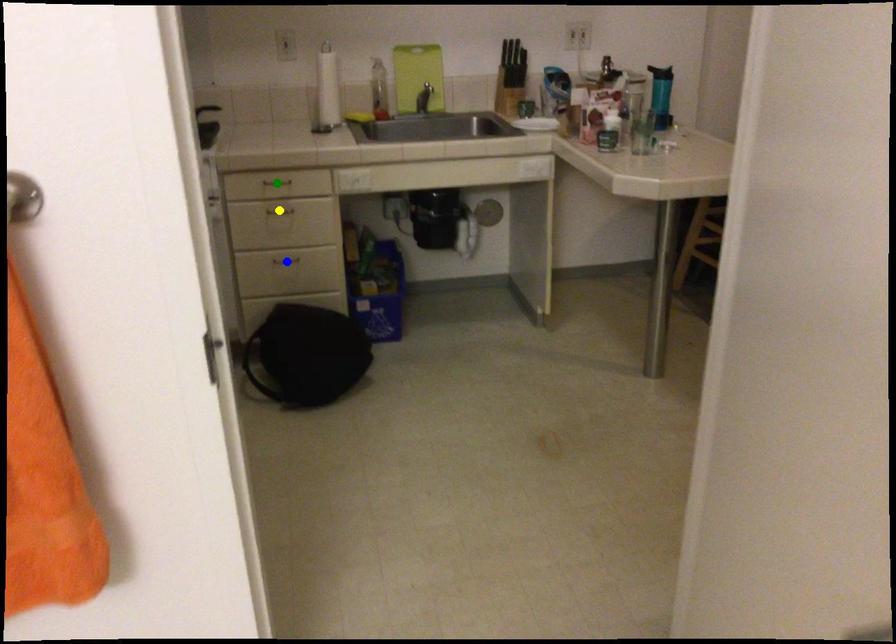
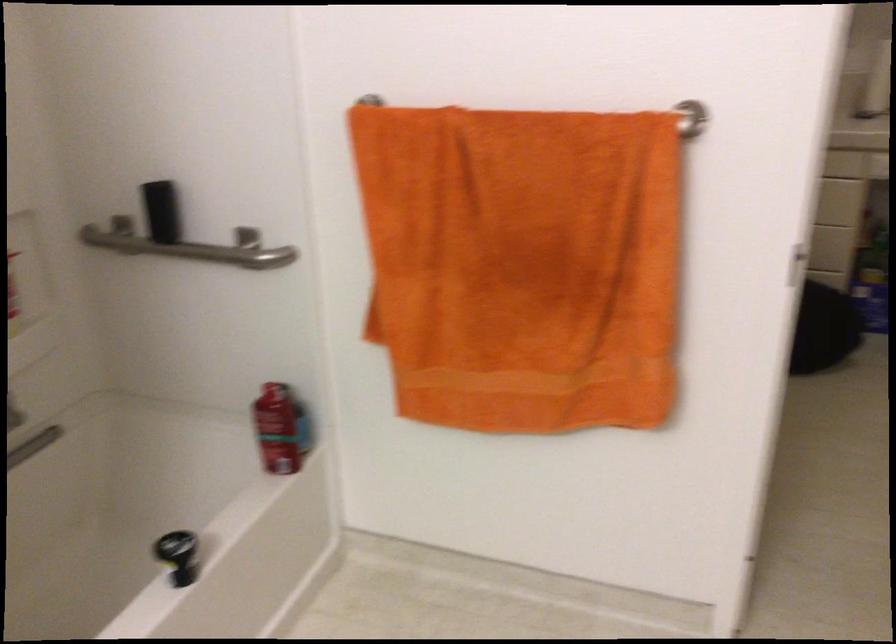
I am providing you with two images of the same scene from different viewpoints. Three points are marked in image1. Which point corresponds to a part or object that is occluded in image2?In image1, three points are marked. Which of them correspond to a part or object that is occluded in image2?Among the three points shown in image1, which one corresponds to a part or object that is no longer visible due to occlusion in image2?

Invisible in image2: yellow point, green point, blue point.